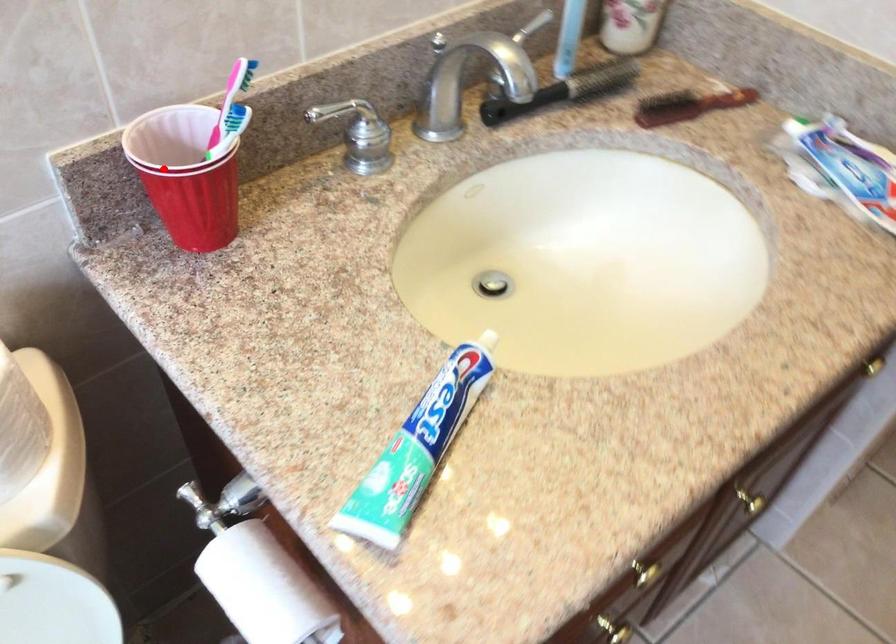
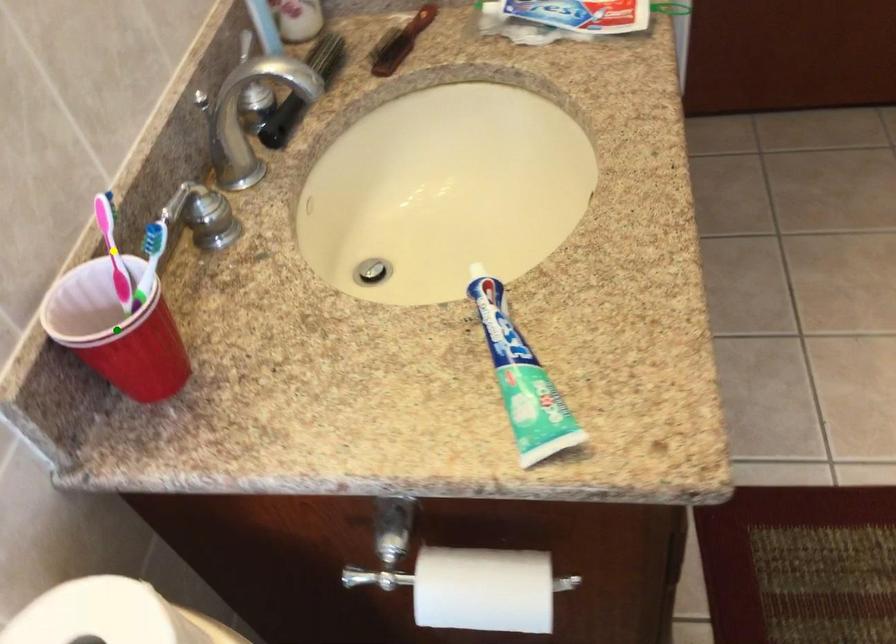
Question: I am providing you with two images of the same scene from different viewpoints. A red point is marked on the first image. You are given multiple points on the second image. Which point in image 2 represents the same 3d spot as the red point in image 1?

Choices:
 (A) blue point
 (B) green point
 (C) yellow point

Answer: (B)